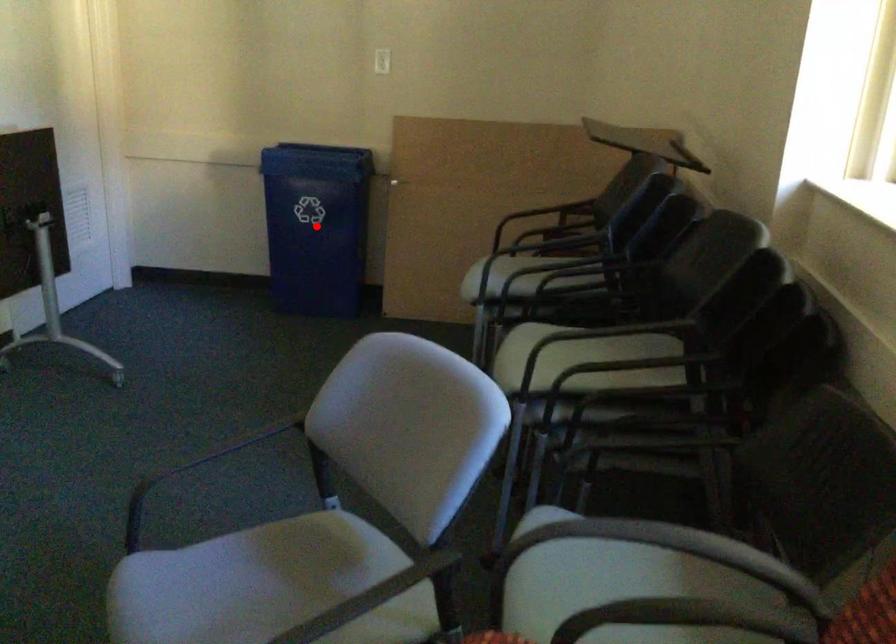
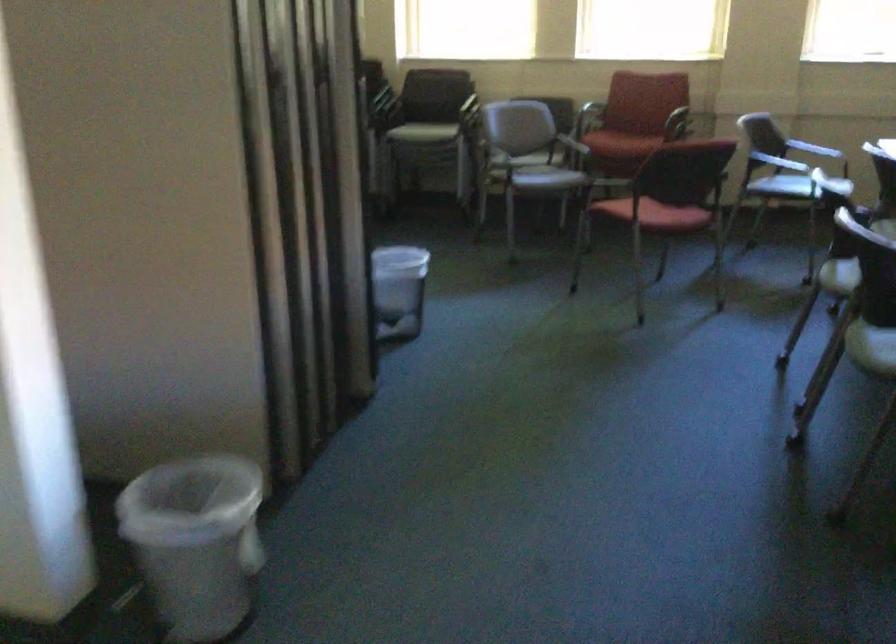
Question: I am providing you with two images of the same scene from different viewpoints. A red point is marked on the first image. Is the red point's position out of view in image 2?

Choices:
 (A) Yes
 (B) No

Answer: (A)